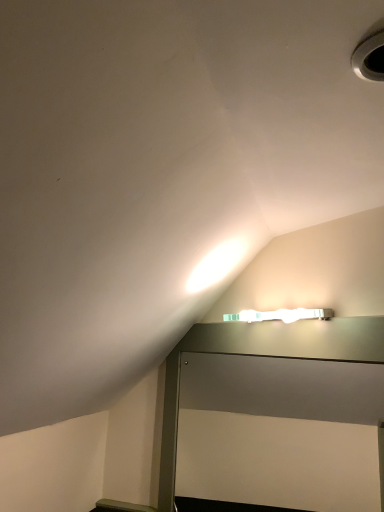
Question: Is white plastic hole at upper right to the left of metallic gray table at upper center from the viewer's perspective?

Choices:
 (A) no
 (B) yes

Answer: (A)

Question: Is white plastic hole at upper right next to metallic gray table at upper center?

Choices:
 (A) no
 (B) yes

Answer: (A)

Question: Does white plastic hole at upper right appear on the right side of metallic gray table at upper center?

Choices:
 (A) no
 (B) yes

Answer: (B)

Question: Considering the relative positions of white plastic hole at upper right and metallic gray table at upper center in the image provided, is white plastic hole at upper right behind metallic gray table at upper center?

Choices:
 (A) no
 (B) yes

Answer: (A)

Question: Is white plastic hole at upper right oriented towards metallic gray table at upper center?

Choices:
 (A) no
 (B) yes

Answer: (A)

Question: From the image's perspective, is white plastic hole at upper right on metallic gray table at upper center?

Choices:
 (A) no
 (B) yes

Answer: (B)

Question: Can you confirm if metallic gray table at upper center is wider than white plastic hole at upper right?

Choices:
 (A) no
 (B) yes

Answer: (A)

Question: Is metallic gray table at upper center next to white plastic hole at upper right?

Choices:
 (A) yes
 (B) no

Answer: (B)

Question: Does metallic gray table at upper center come in front of white plastic hole at upper right?

Choices:
 (A) yes
 (B) no

Answer: (B)

Question: Are metallic gray table at upper center and white plastic hole at upper right located far from each other?

Choices:
 (A) no
 (B) yes

Answer: (A)

Question: Does metallic gray table at upper center appear on the right side of white plastic hole at upper right?

Choices:
 (A) no
 (B) yes

Answer: (A)

Question: From a real-world perspective, is metallic gray table at upper center under white plastic hole at upper right?

Choices:
 (A) no
 (B) yes

Answer: (B)

Question: From the image's perspective, is white plastic hole at upper right positioned above or below metallic gray table at upper center?

Choices:
 (A) below
 (B) above

Answer: (B)